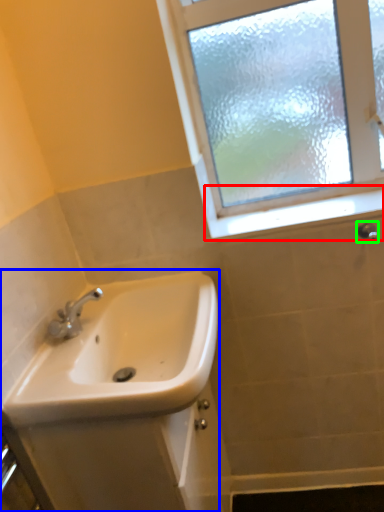
Question: Which object is positioned closest to window sill (highlighted by a red box)? Select from sink (highlighted by a blue box) and shower (highlighted by a green box).

Choices:
 (A) sink
 (B) shower

Answer: (B)